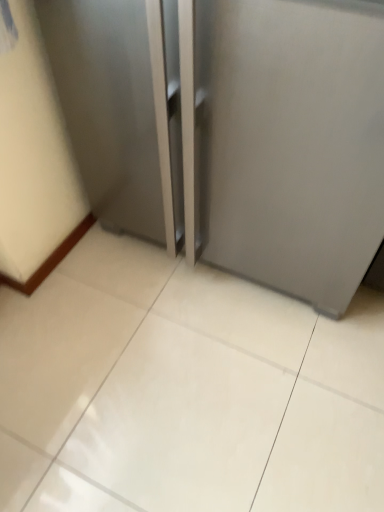
The image size is (384, 512). What do you see at coordinates (232, 131) in the screenshot? I see `satin silver refrigerator at center` at bounding box center [232, 131].

What are the coordinates of `satin silver refrigerator at center` in the screenshot? It's located at (232, 131).

The image size is (384, 512). In order to click on satin silver refrigerator at center in this screenshot , I will do `click(232, 131)`.